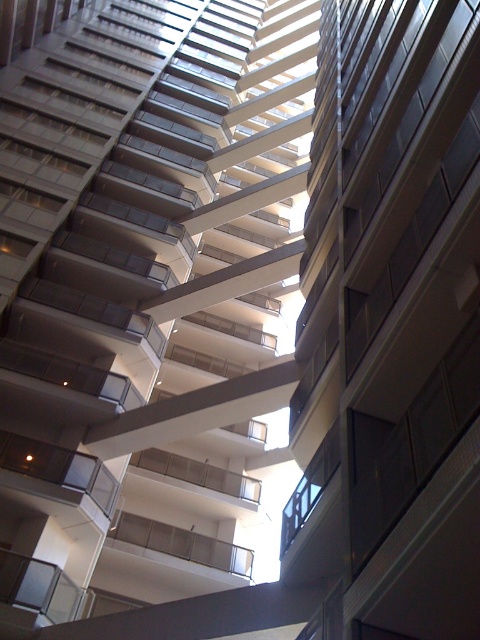
Question: Estimate the real-world distances between objects in this image. Which object is closer to the metallic silver balcony at center?

Choices:
 (A) glassy transparent balcony at center
 (B) clear glass balcony at lower left
 (C) white glass balcony at center

Answer: (C)

Question: In this image, where is metallic silver balcony at center located relative to white glass balcony at center?

Choices:
 (A) below
 (B) above

Answer: (A)

Question: Which object appears closest to the camera in this image?

Choices:
 (A) white glass balcony at center
 (B) clear glass balcony at lower left
 (C) glassy transparent balcony at center

Answer: (B)

Question: Among these objects, which one is farthest from the camera?

Choices:
 (A) metallic silver balcony at center
 (B) white glass balcony at center
 (C) glassy transparent balcony at center
 (D) clear glass balcony at lower left

Answer: (B)

Question: Is glassy transparent balcony at center closer to camera compared to white glass balcony at center?

Choices:
 (A) no
 (B) yes

Answer: (B)

Question: Is metallic silver balcony at center above glassy transparent balcony at center?

Choices:
 (A) yes
 (B) no

Answer: (B)